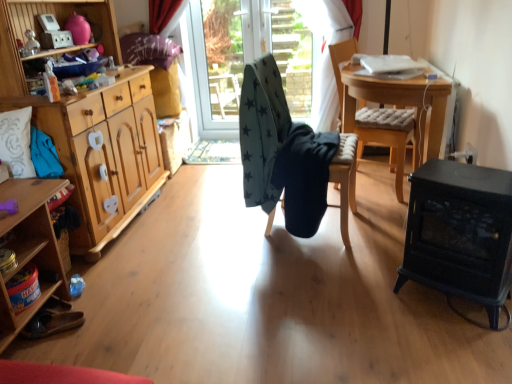
Question: Does wooden cabinet at left have a greater height compared to wooden table at center?

Choices:
 (A) no
 (B) yes

Answer: (A)

Question: From the image's perspective, does wooden cabinet at left appear lower than wooden table at center?

Choices:
 (A) yes
 (B) no

Answer: (A)

Question: From a real-world perspective, is wooden cabinet at left under wooden table at center?

Choices:
 (A) yes
 (B) no

Answer: (A)

Question: From a real-world perspective, is wooden cabinet at left positioned over wooden table at center based on gravity?

Choices:
 (A) yes
 (B) no

Answer: (B)

Question: Is wooden cabinet at left bigger than wooden table at center?

Choices:
 (A) no
 (B) yes

Answer: (A)

Question: Is wooden cabinet at left not close to wooden table at center?

Choices:
 (A) no
 (B) yes

Answer: (B)

Question: Considering the relative sizes of wooden cabinet at left and black cast iron fireplace at lower right in the image provided, is wooden cabinet at left smaller than black cast iron fireplace at lower right?

Choices:
 (A) yes
 (B) no

Answer: (B)

Question: From the image's perspective, is wooden cabinet at left located above black cast iron fireplace at lower right?

Choices:
 (A) yes
 (B) no

Answer: (B)

Question: From a real-world perspective, is wooden cabinet at left located higher than black cast iron fireplace at lower right?

Choices:
 (A) no
 (B) yes

Answer: (B)

Question: From a real-world perspective, is wooden cabinet at left located beneath black cast iron fireplace at lower right?

Choices:
 (A) no
 (B) yes

Answer: (A)

Question: Would you say wooden cabinet at left is outside black cast iron fireplace at lower right?

Choices:
 (A) no
 (B) yes

Answer: (B)

Question: Is wooden cabinet at left taller than black cast iron fireplace at lower right?

Choices:
 (A) no
 (B) yes

Answer: (A)

Question: Is wooden cabinet at left beside dark blue fabric at center, the second chair in the left-to-right sequence?

Choices:
 (A) yes
 (B) no

Answer: (B)